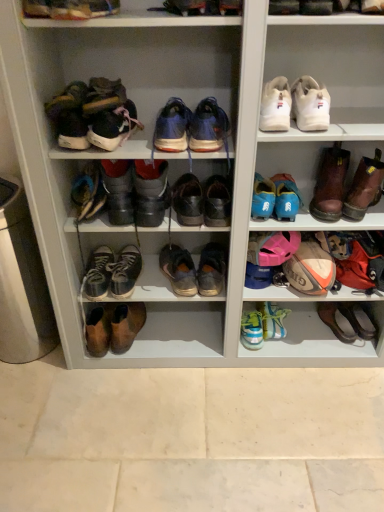
The width and height of the screenshot is (384, 512). In order to click on white leather sneakers at upper right, which ranks as the 3th footwear in right-to-left order in this screenshot , I will do `click(294, 105)`.

Find the location of a particular element. Image resolution: width=384 pixels, height=512 pixels. blue suede sneakers at center, the fourth footwear in the right-to-left sequence is located at coordinates (208, 127).

You are a GUI agent. You are given a task and a screenshot of the screen. Output one action in this format:
    pyautogui.click(x=<x>, y=<y>)
    Task: Click on the shiny blue sneakers at center, placed as the sixth footwear when sorted from left to right
    Image resolution: width=384 pixels, height=512 pixels.
    Given the screenshot: What is the action you would take?
    pyautogui.click(x=172, y=127)

This screenshot has height=512, width=384. I want to click on leather at center, which appears as the 4th shoe when viewed from the right, so click(x=217, y=202).

From the image's perspective, is light blue fabric sneaker at lower center, positioned as the ninth shoe in left-to-right order, located beneath white leather sneakers at upper right, which ranks as the 3th footwear in right-to-left order?

Yes, from the image's perspective, light blue fabric sneaker at lower center, positioned as the ninth shoe in left-to-right order, is beneath white leather sneakers at upper right, which ranks as the 3th footwear in right-to-left order.

From a real-world perspective, starting from the light blue fabric sneaker at lower center, arranged as the first shoe when viewed from the right, which footwear is the 10th one vertically above it? Please provide its 2D coordinates.

[(294, 105)]

From a real-world perspective, which object rests below the other?

From a 3D spatial view, light blue fabric sneaker at lower center, arranged as the first shoe when viewed from the right, is below.

Can you confirm if matte brown shoe at upper left, placed as the eleventh footwear when sorted from right to left, is smaller than light blue synthetic sneakers at lower center, which ranks as the seventh shoe in left-to-right order?

No, matte brown shoe at upper left, placed as the eleventh footwear when sorted from right to left, is not smaller than light blue synthetic sneakers at lower center, which ranks as the seventh shoe in left-to-right order.

Based on the photo, is matte brown shoe at upper left, placed as the eleventh footwear when sorted from right to left, placed right next to light blue synthetic sneakers at lower center, which ranks as the seventh shoe in left-to-right order?

There is a gap between matte brown shoe at upper left, placed as the eleventh footwear when sorted from right to left, and light blue synthetic sneakers at lower center, which ranks as the seventh shoe in left-to-right order.

Looking at this image, can you confirm if matte brown shoe at upper left, placed as the 1th footwear when sorted from left to right, is positioned to the left of light blue synthetic sneakers at lower center, which ranks as the seventh shoe in left-to-right order?

Yes.

Is matte brown shoe at upper left, placed as the eleventh footwear when sorted from right to left, oriented towards light blue synthetic sneakers at lower center, arranged as the 3th shoe when viewed from the right?

No, matte brown shoe at upper left, placed as the eleventh footwear when sorted from right to left, is not facing towards light blue synthetic sneakers at lower center, arranged as the 3th shoe when viewed from the right.

Does point (180, 201) appear closer or farther from the camera than point (284, 108)?

Point (180, 201) appears to be farther away from the viewer than point (284, 108).

Considering the sizes of objects leather shoe at center, which is counted as the fourth shoe, starting from the left, and white leather sneakers at upper right, the second shoe when ordered from right to left, in the image provided, who is bigger, leather shoe at center, which is counted as the fourth shoe, starting from the left, or white leather sneakers at upper right, the second shoe when ordered from right to left,?

With larger size is white leather sneakers at upper right, the second shoe when ordered from right to left.

Is leather shoe at center, which is counted as the fourth shoe, starting from the left, spatially inside white leather sneakers at upper right, the 8th shoe when ordered from left to right, or outside of it?

leather shoe at center, which is counted as the fourth shoe, starting from the left, exists outside the volume of white leather sneakers at upper right, the 8th shoe when ordered from left to right.

Is leather shoe at center, the sixth shoe positioned from the right, oriented away from white leather sneakers at upper right, the second shoe when ordered from right to left?

No, leather shoe at center, the sixth shoe positioned from the right,'s orientation is not away from white leather sneakers at upper right, the second shoe when ordered from right to left.

Between brown leather shoe at lower right, which ranks as the first footwear in right-to-left order, and light blue synthetic sneakers at lower center, arranged as the 3th shoe when viewed from the right, which one has more height?

With more height is light blue synthetic sneakers at lower center, arranged as the 3th shoe when viewed from the right.

Can you tell me how much brown leather shoe at lower right, which ranks as the first footwear in right-to-left order, and light blue synthetic sneakers at lower center, arranged as the 3th shoe when viewed from the right, differ in facing direction?

The angle between the facing direction of brown leather shoe at lower right, which ranks as the first footwear in right-to-left order, and the facing direction of light blue synthetic sneakers at lower center, arranged as the 3th shoe when viewed from the right, is 16.3 degrees.

From the image's perspective, who appears lower, brown leather shoe at lower right, which ranks as the first footwear in right-to-left order, or light blue synthetic sneakers at lower center, arranged as the 3th shoe when viewed from the right?

light blue synthetic sneakers at lower center, arranged as the 3th shoe when viewed from the right, is shown below in the image.

From a real-world perspective, is brown leather shoe at lower right, positioned as the eleventh footwear in left-to-right order, below light blue synthetic sneakers at lower center, which ranks as the seventh shoe in left-to-right order?

Yes, from a real-world perspective, brown leather shoe at lower right, positioned as the eleventh footwear in left-to-right order, is under light blue synthetic sneakers at lower center, which ranks as the seventh shoe in left-to-right order.

Does point (172, 101) come farther from viewer compared to point (96, 88)?

Yes.

Can you confirm if shiny blue sneakers at center, arranged as the 6th footwear when viewed from the right, is wider than leather lace-up shoes at upper left, which appears as the fourth footwear when viewed from the left?

Incorrect, the width of shiny blue sneakers at center, arranged as the 6th footwear when viewed from the right, does not surpass that of leather lace-up shoes at upper left, which appears as the fourth footwear when viewed from the left.

Is shiny blue sneakers at center, arranged as the 6th footwear when viewed from the right, completely or partially outside of leather lace-up shoes at upper left, which appears as the fourth footwear when viewed from the left?

Yes, shiny blue sneakers at center, arranged as the 6th footwear when viewed from the right, is outside of leather lace-up shoes at upper left, which appears as the fourth footwear when viewed from the left.

From the image's perspective, is shiny blue sneakers at center, arranged as the 6th footwear when viewed from the right, below leather lace-up shoes at upper left, placed as the 8th footwear when sorted from right to left?

No, from the image's perspective, shiny blue sneakers at center, arranged as the 6th footwear when viewed from the right, is not below leather lace-up shoes at upper left, placed as the 8th footwear when sorted from right to left.

Does light blue fabric sneaker at lower center, arranged as the first shoe when viewed from the right, have a lesser width compared to brown leather shoe at lower right, positioned as the eleventh footwear in left-to-right order?

Correct, the width of light blue fabric sneaker at lower center, arranged as the first shoe when viewed from the right, is less than that of brown leather shoe at lower right, positioned as the eleventh footwear in left-to-right order.

Could you tell me if light blue fabric sneaker at lower center, arranged as the first shoe when viewed from the right, is facing brown leather shoe at lower right, which ranks as the first footwear in right-to-left order?

No, light blue fabric sneaker at lower center, arranged as the first shoe when viewed from the right, is not facing towards brown leather shoe at lower right, which ranks as the first footwear in right-to-left order.

From a real-world perspective, does light blue fabric sneaker at lower center, positioned as the ninth shoe in left-to-right order, stand above brown leather shoe at lower right, positioned as the eleventh footwear in left-to-right order?

Actually, light blue fabric sneaker at lower center, positioned as the ninth shoe in left-to-right order, is physically below brown leather shoe at lower right, positioned as the eleventh footwear in left-to-right order, in the real world.

Does point (266, 312) come in front of point (338, 305)?

Yes, it is.

Is shiny blue sneakers at center, placed as the sixth footwear when sorted from left to right, to the right of leather lace-up shoe at center, positioned as the 3th shoe in left-to-right order, from the viewer's perspective?

Yes.

Which shoe is the 5th one when counting from the back of the shiny blue sneakers at center, placed as the sixth footwear when sorted from left to right? Please provide its 2D coordinates.

[(125, 271)]

Considering the positions of points (166, 104) and (118, 272), is point (166, 104) farther from camera compared to point (118, 272)?

No, (166, 104) is in front of (118, 272).

How distant is shiny blue sneakers at center, placed as the sixth footwear when sorted from left to right, from leather lace-up shoe at center, which is the 7th shoe in right-to-left order?

shiny blue sneakers at center, placed as the sixth footwear when sorted from left to right, and leather lace-up shoe at center, which is the 7th shoe in right-to-left order, are 22.36 inches apart.

In order to click on the 10th footwear positioned above the light blue fabric sneaker at lower center, positioned as the ninth shoe in left-to-right order (from the image's perspective) in this screenshot , I will do `click(294, 105)`.

From a real-world perspective, starting from the light blue synthetic sneakers at lower center, which ranks as the seventh shoe in left-to-right order, which footwear is the 10th one vertically above it? Please provide its 2D coordinates.

[(70, 9)]

When comparing their distances from leather lace-up shoe at center, which is the 7th shoe in right-to-left order, does matte brown shoe at upper left, placed as the 1th footwear when sorted from left to right, or leather shoes at center, which appears as the 7th footwear when viewed from the right, seem closer?

The object closer to leather lace-up shoe at center, which is the 7th shoe in right-to-left order, is leather shoes at center, which appears as the 7th footwear when viewed from the right.

Consider the image. Which object lies further to the anchor point brown leather boots at right, which is the second footwear in right-to-left order, worn leather shoes at center, the 5th shoe from the left, or shiny blue sneakers at center, arranged as the 6th footwear when viewed from the right?

shiny blue sneakers at center, arranged as the 6th footwear when viewed from the right, is further to brown leather boots at right, which is the second footwear in right-to-left order.

Looking at the image, which one is located further to blue suede sneakers at center, the fourth footwear in the right-to-left sequence, light blue synthetic sneakers at lower center, which ranks as the seventh shoe in left-to-right order, or leather shoes at center, positioned as the 8th shoe in right-to-left order?

light blue synthetic sneakers at lower center, which ranks as the seventh shoe in left-to-right order, is further to blue suede sneakers at center, the fourth footwear in the right-to-left sequence.

Based on their spatial positions, is leather lace-up shoes at upper left, placed as the 8th footwear when sorted from right to left, or white leather sneakers at upper right, which is counted as the ninth footwear, starting from the left, further from brown leather boots at right, which is the second footwear in right-to-left order?

leather lace-up shoes at upper left, placed as the 8th footwear when sorted from right to left.

From the image, which object appears to be nearer to leather at center, which appears as the 4th shoe when viewed from the right, light blue synthetic sneakers at lower center, arranged as the 3th shoe when viewed from the right, or leather shoes at center, which appears as the 7th footwear when viewed from the right?

leather shoes at center, which appears as the 7th footwear when viewed from the right, lies closer to leather at center, which appears as the 4th shoe when viewed from the right, than the other object.

Considering their positions, is leather shoe at center, which is counted as the fourth shoe, starting from the left, positioned closer to brown leather boots at right, which is the second footwear in right-to-left order, than blue suede sneakers at center, the fourth footwear in the right-to-left sequence?

Based on the image, leather shoe at center, which is counted as the fourth shoe, starting from the left, appears to be nearer to brown leather boots at right, which is the second footwear in right-to-left order.

In the scene shown: Based on their spatial positions, is leather at center, which appears as the 4th shoe when viewed from the right, or matte brown shoe at upper left, placed as the 1th footwear when sorted from left to right, further from worn leather shoes at center, placed as the 5th footwear when sorted from right to left?

matte brown shoe at upper left, placed as the 1th footwear when sorted from left to right.

When comparing their distances from leather shoes at center, positioned as the 8th shoe in right-to-left order, does leather shoes at center, which appears as the 7th footwear when viewed from the right, or leather shoes at center, the ninth footwear when ordered from right to left, seem closer?

leather shoes at center, the ninth footwear when ordered from right to left, is closer to leather shoes at center, positioned as the 8th shoe in right-to-left order.

Find the location of `footwear between leather at center, the sixth shoe when ordered from left to right, and worn leather shoes at center, which is the 5th shoe in right-to-left order, vertically`. footwear between leather at center, the sixth shoe when ordered from left to right, and worn leather shoes at center, which is the 5th shoe in right-to-left order, vertically is located at coordinates (194, 270).

Image resolution: width=384 pixels, height=512 pixels. Identify the location of shoe between leather shoes at center, positioned as the 8th shoe in right-to-left order, and leather shoe at center, the sixth shoe positioned from the right, in the horizontal direction. (125, 271).

Image resolution: width=384 pixels, height=512 pixels. What are the coordinates of `footwear between leather at center, which appears as the 4th shoe when viewed from the right, and leather boots at center, the 10th footwear from the right, from top to bottom` in the screenshot? It's located at (194, 270).

The image size is (384, 512). I want to click on shoe between leather shoe at center, which is counted as the fourth shoe, starting from the left, and worn leather shoes at center, placed as the 5th footwear when sorted from right to left, in the vertical direction, so click(x=217, y=202).